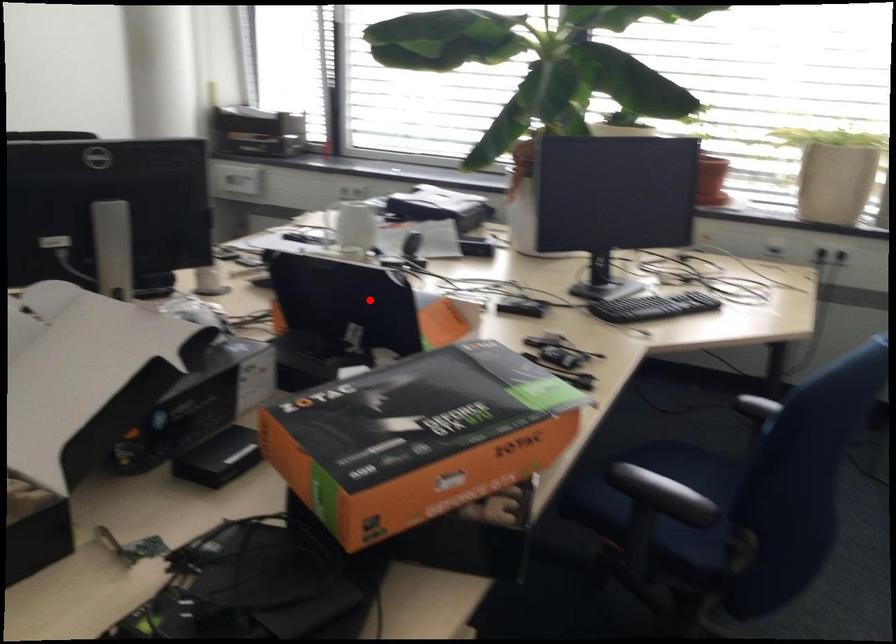
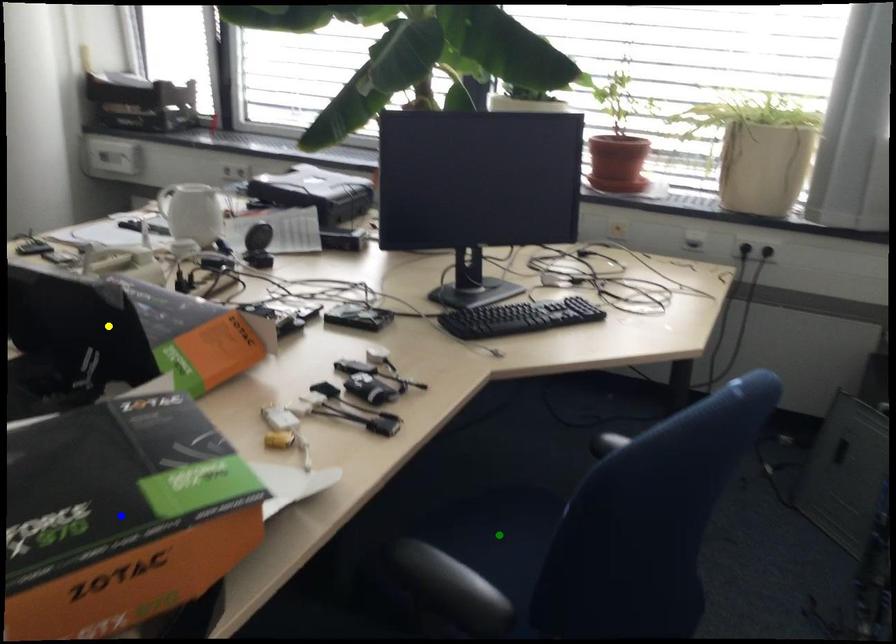
Question: I am providing you with two images of the same scene from different viewpoints. A red point is marked on the first image. You are given multiple points on the second image. Which spot in image 2 lines up with the point in image 1?

Choices:
 (A) yellow point
 (B) blue point
 (C) green point

Answer: (A)